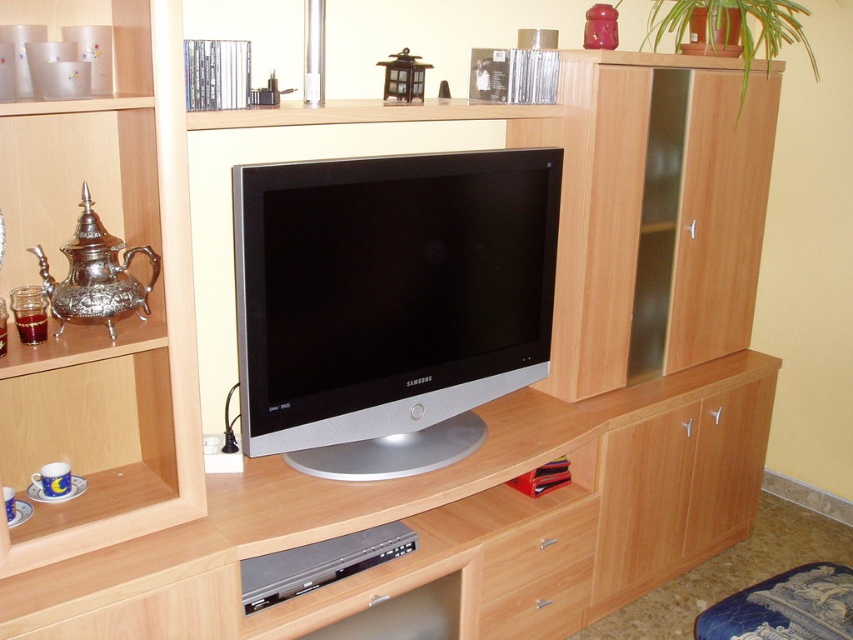
You are trying to place a new decorative item on the entertainment unit. The item is taller than the satin silver flat at center but shorter than the matte silver teapot at left. Where could you place it without blocking the TV?

You can place the item on the open shelves or drawers below the satin silver flat at center since it is taller than the flat but shorter than the matte silver teapot at left, ensuring it won

You are arranging a new TV stand and need to place the satin silver flat at center and the wooden drawer at lower center. According to the scene, which object should be placed to the left side?

The satin silver flat at center should be placed to the left side because it is to the left of the wooden drawer at lower center in the scene.